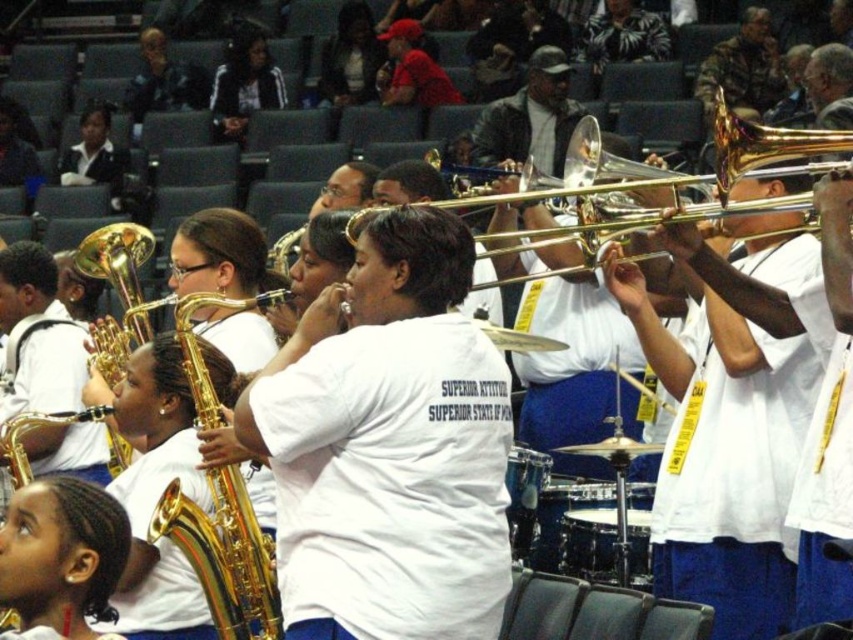
Who is more distant from viewer, [260,83] or [421,166]?

Point [260,83]

Looking at this image, who is positioned more to the right, black jacket at upper left or white matte saxophone at center?

Positioned to the right is white matte saxophone at center.

Where is `black jacket at upper left`? This screenshot has height=640, width=853. black jacket at upper left is located at coordinates (244, 83).

Identify the location of black jacket at upper left. This screenshot has width=853, height=640. (244, 83).

Is point (186, 316) closer to camera compared to point (78, 532)?

No, it is not.

Is the position of gold shiny saxophone at center less distant than that of smooth gold saxophone at lower left?

That is False.

You are a GUI agent. You are given a task and a screenshot of the screen. Output one action in this format:
    pyautogui.click(x=<x>, y=<y>)
    Task: Click on the gold shiny saxophone at center
    The height and width of the screenshot is (640, 853).
    Given the screenshot: What is the action you would take?
    pyautogui.click(x=225, y=554)

At what (x,y) coordinates should I click in order to perform the action: click on gold shiny saxophone at center. Please return your answer as a coordinate pair (x, y). The image size is (853, 640). Looking at the image, I should click on (225, 554).

Is black jacket at upper left below gold brass trumpet at center?

No.

Based on the photo, does black jacket at upper left have a greater height compared to gold brass trumpet at center?

Incorrect, black jacket at upper left's height is not larger of gold brass trumpet at center's.

Find the location of a particular element. black jacket at upper left is located at coordinates (244, 83).